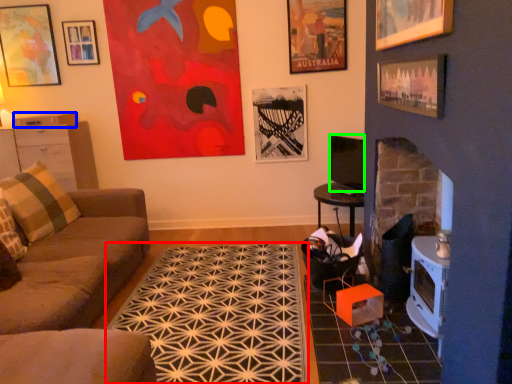
Question: Based on their relative distances, which object is farther from mat (highlighted by a red box)? Choose from drawer (highlighted by a blue box) and television (highlighted by a green box).

Choices:
 (A) drawer
 (B) television

Answer: (A)